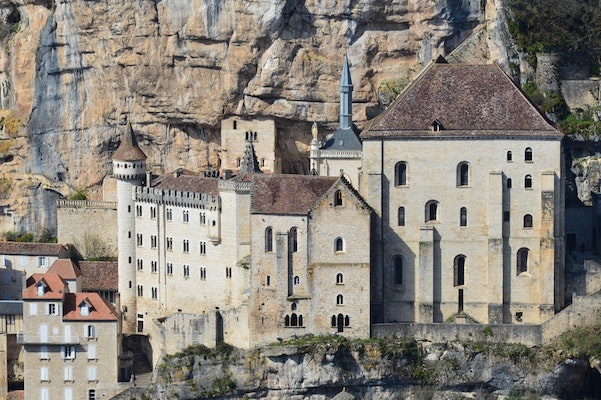
Find the location of a particular element. windows is located at coordinates (398, 171), (462, 169), (433, 210), (461, 273), (343, 323), (269, 234), (187, 271), (92, 376), (46, 375).